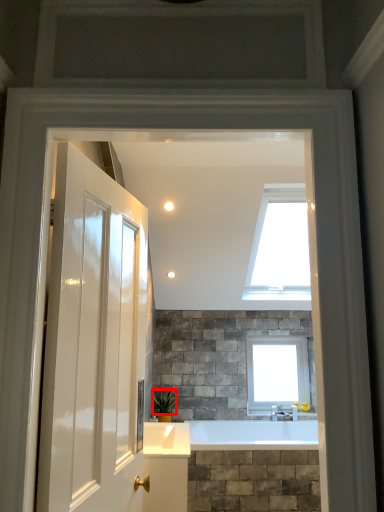
Question: Observing the image, what is the correct spatial positioning of plant (annotated by the red box) in reference to window?

Choices:
 (A) right
 (B) left

Answer: (B)